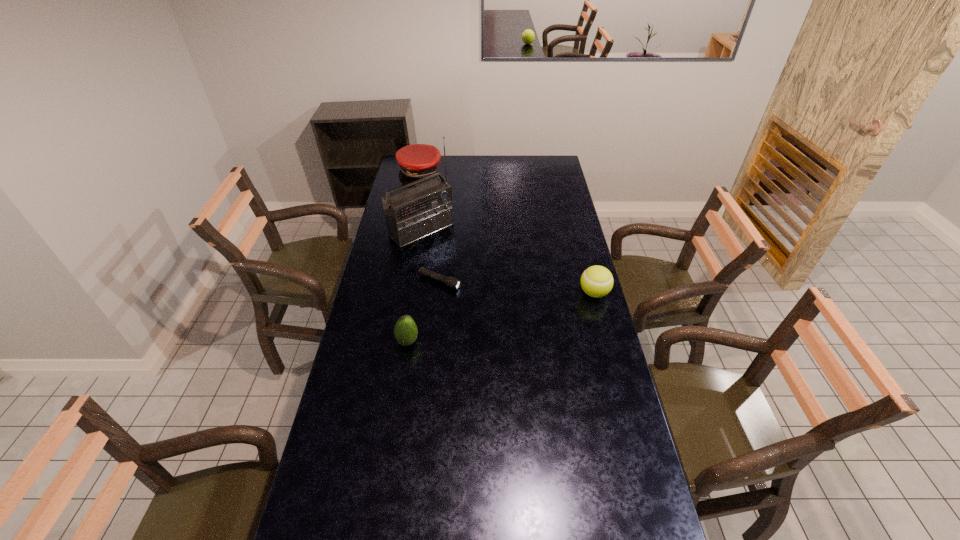
The width and height of the screenshot is (960, 540). What are the coordinates of `free space located on the front panel of the second farthest object` in the screenshot? It's located at (478, 279).

The height and width of the screenshot is (540, 960). Find the location of `vacant space positioned 0.180m at the lens end of the flashlight`. vacant space positioned 0.180m at the lens end of the flashlight is located at coordinates (498, 303).

Where is `free space located 0.230m at the lens end of the flashlight`? free space located 0.230m at the lens end of the flashlight is located at coordinates (510, 307).

The height and width of the screenshot is (540, 960). In order to click on free location located 0.220m at the lens end of the flashlight in this screenshot , I will do `click(508, 306)`.

You are a GUI agent. You are given a task and a screenshot of the screen. Output one action in this format:
    pyautogui.click(x=<x>, y=<y>)
    Task: Click on the free space located 0.200m at the front of the farthest object where the visor is located
    The width and height of the screenshot is (960, 540).
    Given the screenshot: What is the action you would take?
    pyautogui.click(x=443, y=202)

Identify the location of free region located 0.190m at the front of the farthest object where the visor is located. The width and height of the screenshot is (960, 540). (442, 201).

This screenshot has height=540, width=960. I want to click on vacant space located at the front of the farthest object where the visor is located, so click(437, 194).

Where is `object at the far edge`? The height and width of the screenshot is (540, 960). object at the far edge is located at coordinates (416, 161).

Find the location of `avocado that is positioned at the left edge`. avocado that is positioned at the left edge is located at coordinates (405, 331).

You are a GUI agent. You are given a task and a screenshot of the screen. Output one action in this format:
    pyautogui.click(x=<x>, y=<y>)
    Task: Click on the radio receiver present at the left edge
    This screenshot has height=540, width=960.
    Given the screenshot: What is the action you would take?
    pyautogui.click(x=412, y=213)